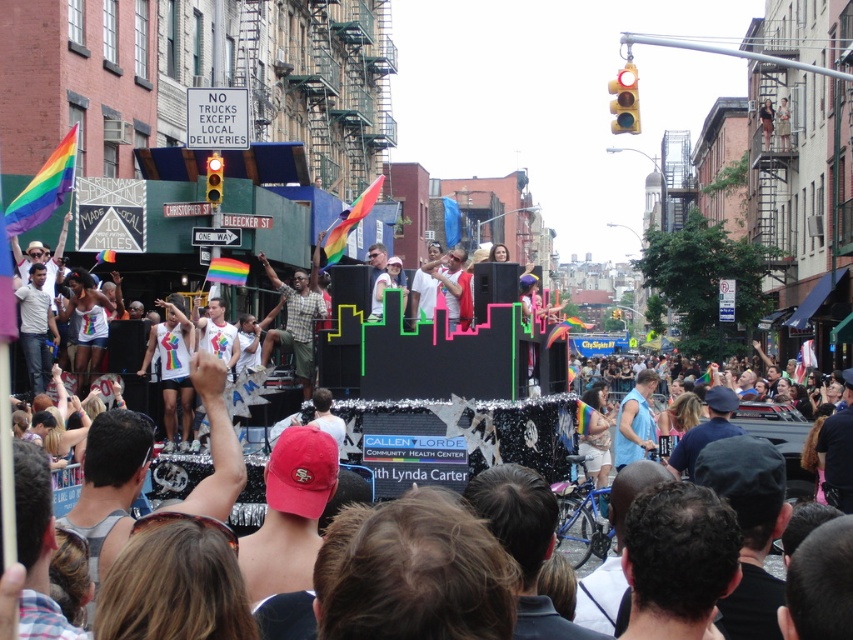
Question: Which point is farther from the camera taking this photo?

Choices:
 (A) (323, 308)
 (B) (747, 406)

Answer: (A)

Question: Is checkered fabric shirt at center positioned at the back of neon plastic float at center?

Choices:
 (A) yes
 (B) no

Answer: (A)

Question: Observing the image, what is the correct spatial positioning of checkered fabric shirt at center in reference to neon plastic float at center?

Choices:
 (A) left
 (B) right

Answer: (A)

Question: Among these points, which one is farthest from the camera?

Choices:
 (A) (560, 422)
 (B) (321, 316)

Answer: (B)

Question: From the image, what is the correct spatial relationship of checkered fabric shirt at center in relation to neon plastic float at center?

Choices:
 (A) right
 (B) left

Answer: (B)